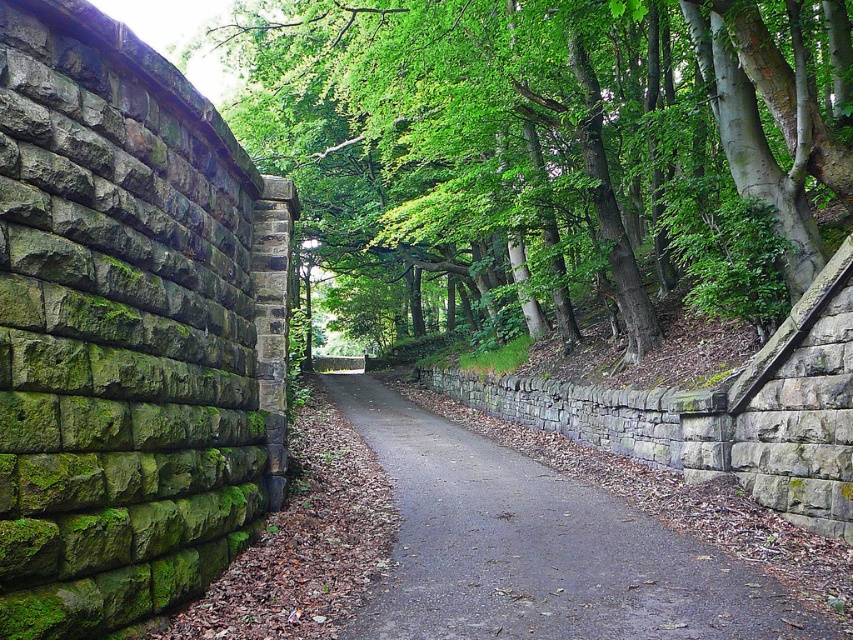
You are a hiker walking along the pathway and want to take a photo of both the green leafy tree at center and the gray stone wall at center. Which object should you position to your left to include both in the frame?

To include both the green leafy tree at center and the gray stone wall at center in the frame, position the gray stone wall at center to your left since the green leafy tree at center is on the right side of it.

You are a hiker walking along the pathway between the green leafy tree at center and the gray stone wall at center. Which object would block your view more if you were to look straight ahead?

The green leafy tree at center is larger in size than the gray stone wall at center, so it would block your view more when looking straight ahead.